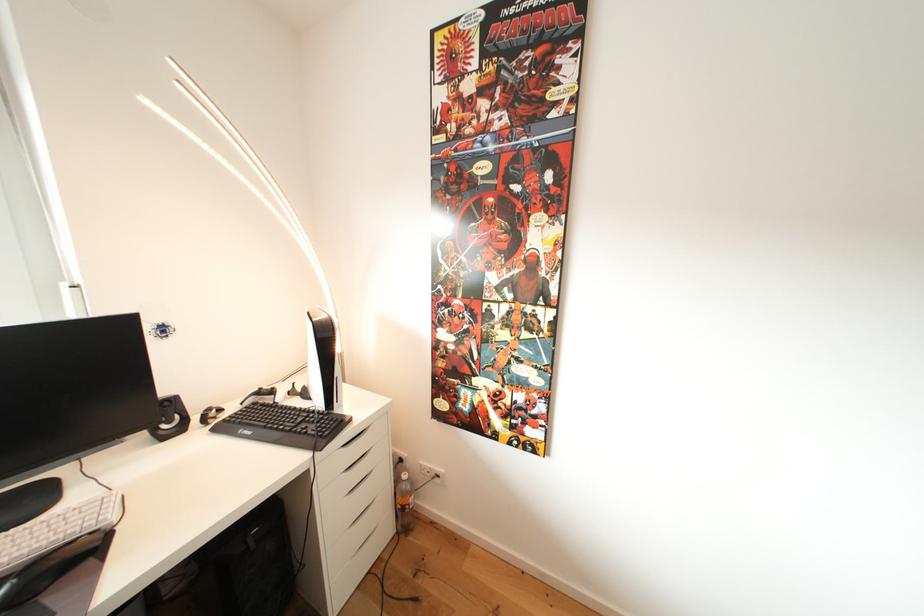
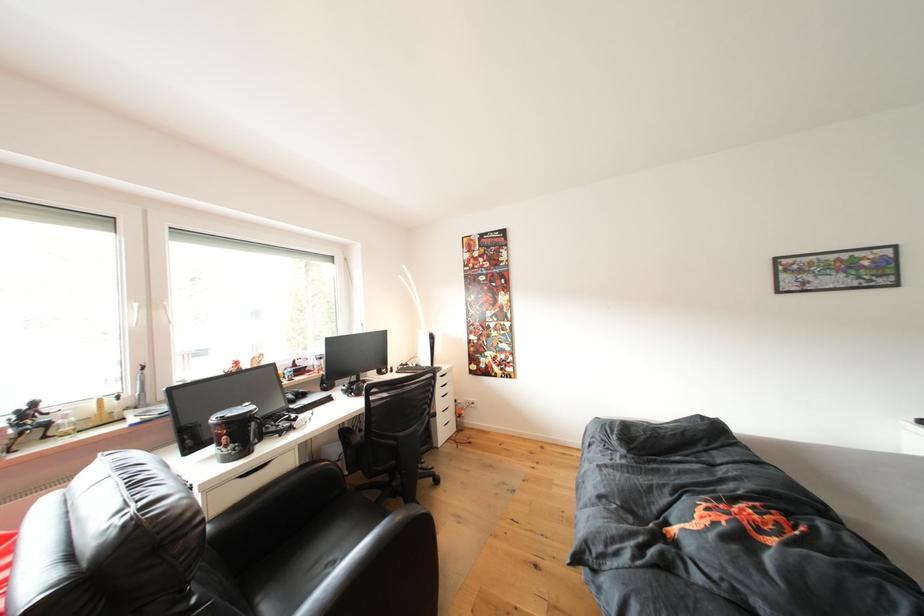
Question: I am providing you with two images of the same scene from different viewpoints. After the viewpoint changes to image2, which objects are now occluded?

Choices:
 (A) black chair armrest
 (B) black computer keyboard
 (C) black chair sitting surface
 (D) white cylindrical cup

Answer: (B)